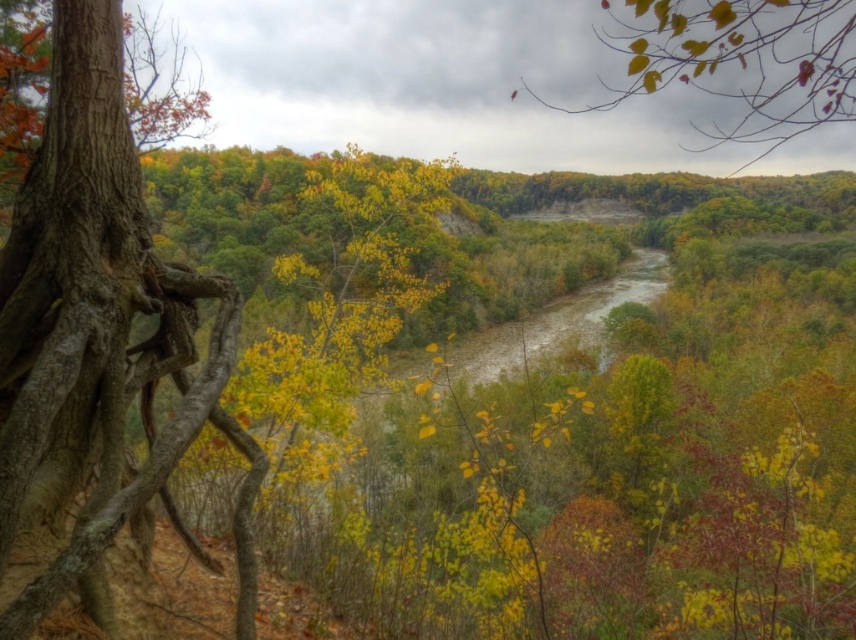
You are standing at the point marked as point (90,321) in the image. What is the surface texture of the object you are standing on?

The point (90,321) is on smooth brown tree trunk at left, so the surface texture is smooth.